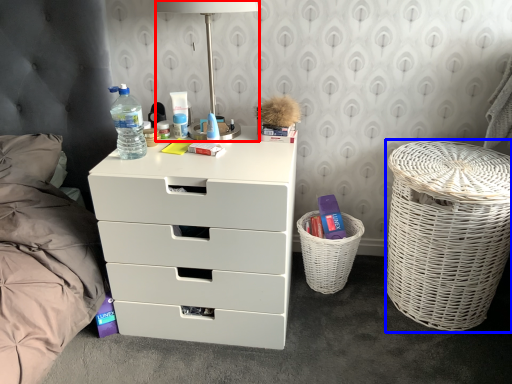
Question: Which object is further to the camera taking this photo, table lamp (highlighted by a red box) or laundry basket (highlighted by a blue box)?

Choices:
 (A) table lamp
 (B) laundry basket

Answer: (B)